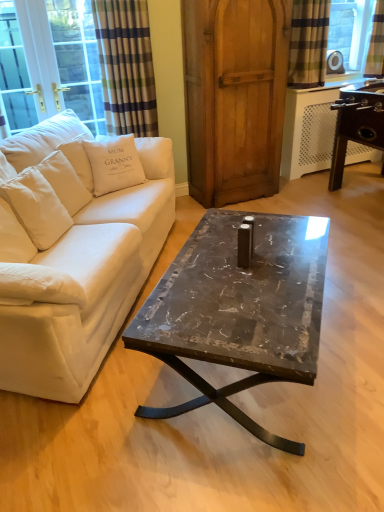
Image resolution: width=384 pixels, height=512 pixels. I want to click on vacant region in front of marble-coated coffee table at center, so click(252, 459).